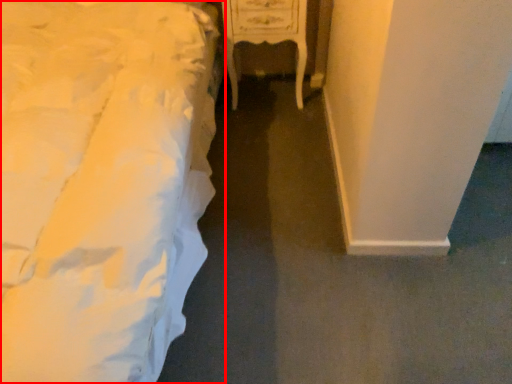
Question: From the image's perspective, what is the correct spatial positioning of bed (annotated by the red box) in reference to furniture?

Choices:
 (A) above
 (B) below

Answer: (B)